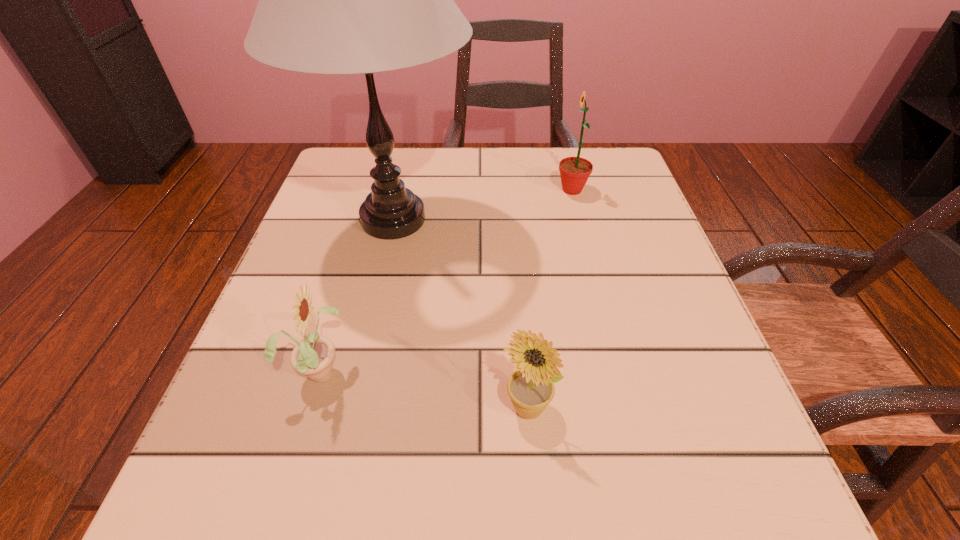
I want to click on free space between the tallest object and the rightmost object, so click(x=483, y=205).

The height and width of the screenshot is (540, 960). Find the location of `vacant area that lies between the leftmost sunflower and the second tallest object`. vacant area that lies between the leftmost sunflower and the second tallest object is located at coordinates (446, 280).

Identify the location of free spot between the leftmost sunflower and the second sunflower from left to right. This screenshot has height=540, width=960. (423, 389).

This screenshot has height=540, width=960. Identify the location of the closest object relative to the leftmost sunflower. (331, 0).

The height and width of the screenshot is (540, 960). I want to click on object that is the closest to the lamp, so click(x=313, y=356).

Where is `the closest sunflower to the third object from left to right`? the closest sunflower to the third object from left to right is located at coordinates (313, 356).

Point out which sunflower is positioned as the nearest to the second object from right to left. Please provide its 2D coordinates. Your answer should be formatted as a tuple, i.e. [(x, y)], where the tuple contains the x and y coordinates of a point satisfying the conditions above.

[(313, 356)]

Find the location of a particular element. free space that satisfies the following two spatial constraints: 1. on the front side of the lamp; 2. on the front-facing side of the leftmost sunflower is located at coordinates (360, 370).

I want to click on vacant space that satisfies the following two spatial constraints: 1. on the face of the second tallest object; 2. on the front side of the tallest object, so click(x=580, y=219).

This screenshot has width=960, height=540. What are the coordinates of `vacant position in the image that satisfies the following two spatial constraints: 1. on the face of the second tallest object; 2. on the front side of the lamp` in the screenshot? It's located at (580, 219).